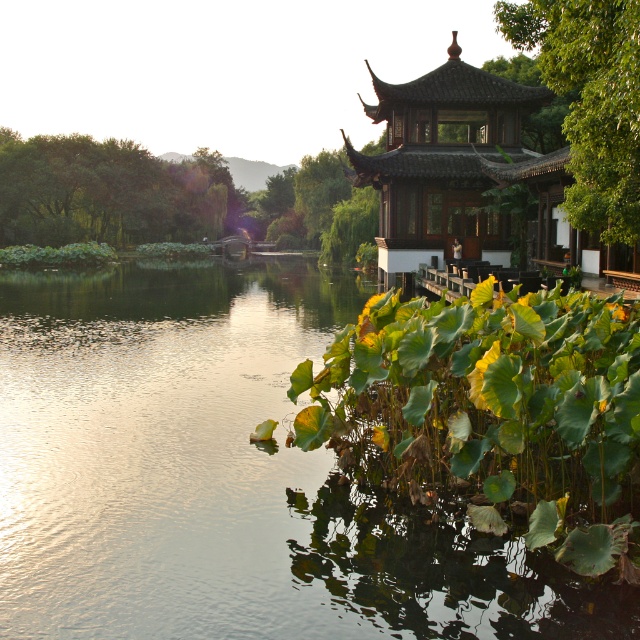
Question: Is green reflective water at lower left above green leafy trees at left?

Choices:
 (A) no
 (B) yes

Answer: (A)

Question: Can you confirm if wooden gazebo at center is positioned to the left of green leafy tree at upper right?

Choices:
 (A) no
 (B) yes

Answer: (B)

Question: Which of the following is the closest to the observer?

Choices:
 (A) green leafy tree at upper right
 (B) green leafy trees at left
 (C) green reflective water at lower left

Answer: (C)

Question: Can you confirm if wooden gazebo at center is positioned to the right of green leafy tree at upper right?

Choices:
 (A) no
 (B) yes

Answer: (A)

Question: Which of the following is the closest to the observer?

Choices:
 (A) (612, 173)
 (B) (324, 456)

Answer: (B)

Question: Which point is farther to the camera?

Choices:
 (A) wooden gazebo at center
 (B) green reflective water at lower left
 (C) green leafy trees at left

Answer: (C)